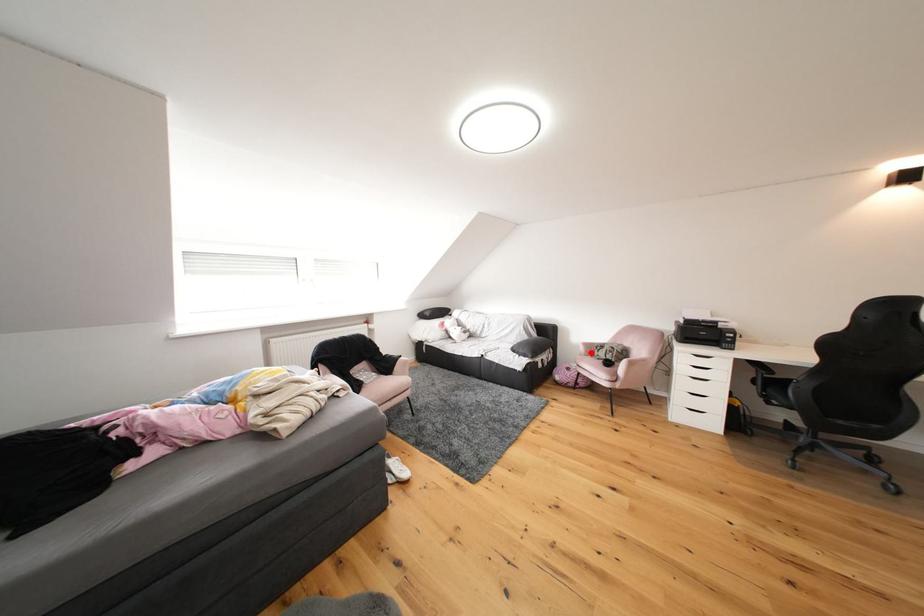
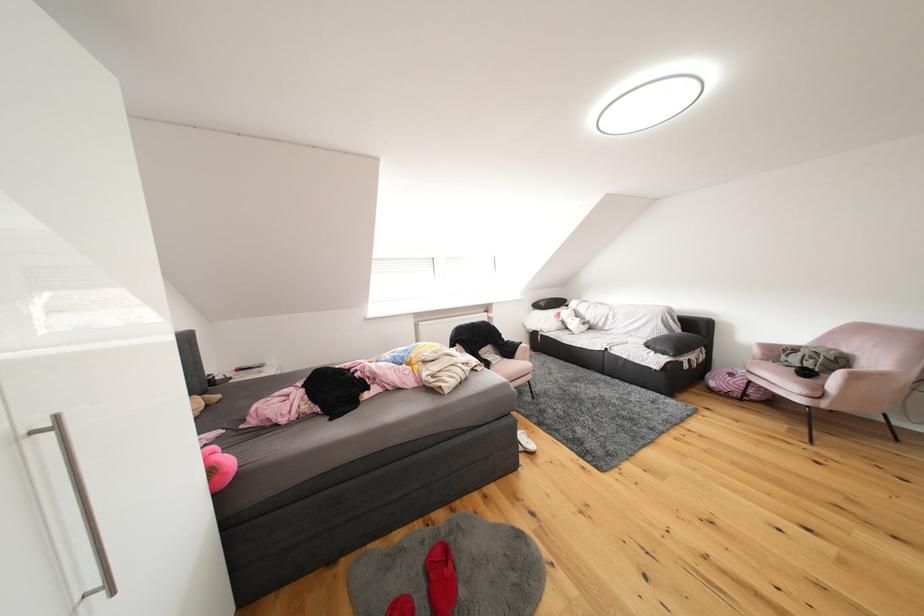
Question: I am providing you with two images of the same scene from different viewpoints. Given a red point in image1, look at the same physical point in image2. Is it:

Choices:
 (A) Closer to the viewpoint
 (B) Farther from the viewpoint

Answer: (A)